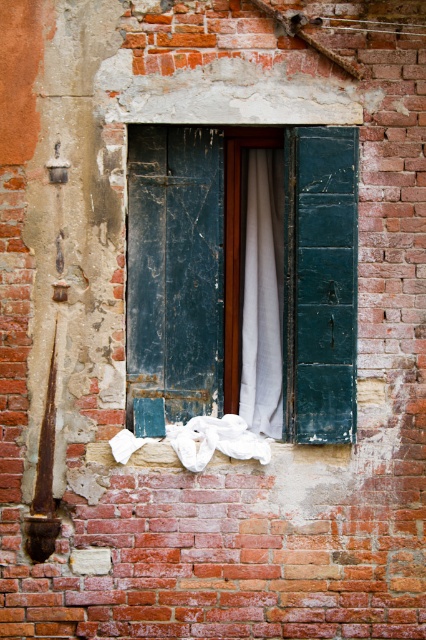
You are standing in front of the brick wall and want to touch both the teal wooden shutters at center and the white cotton cloth at lower center. Which object should you reach for first to touch the one closer to you?

You should reach for the teal wooden shutters at center first because it is closer to you than the white cotton cloth at lower center.

In the scene shown: You are a painter standing in front of the brick wall. You have a 16 inch wide canvas. Can you fit both the white fabric curtain at center and the white cotton cloth at lower center on your canvas without overlapping?

The distance between the white fabric curtain at center and the white cotton cloth at lower center is 15.36 inches. Since your canvas is 16 inches wide, you can fit both objects on the canvas without overlapping as the total space needed is just under 16 inches.